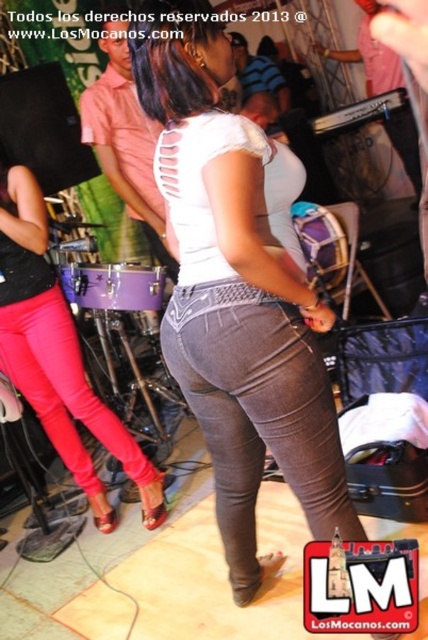
Can you confirm if denim jeans at center is thinner than pink matte pants at left?

Yes, denim jeans at center is thinner than pink matte pants at left.

Who is positioned more to the right, denim jeans at center or pink matte pants at left?

From the viewer's perspective, denim jeans at center appears more on the right side.

This screenshot has height=640, width=428. What are the coordinates of `denim jeans at center` in the screenshot? It's located at (235, 292).

Is denim jeans at center to the left of gray denim jeans at center from the viewer's perspective?

Correct, you'll find denim jeans at center to the left of gray denim jeans at center.

Can you confirm if denim jeans at center is positioned below gray denim jeans at center?

No.

I want to click on denim jeans at center, so click(235, 292).

Where is `denim jeans at center`? This screenshot has height=640, width=428. denim jeans at center is located at coordinates (235, 292).

Does gray denim jeans at center have a lesser height compared to pink matte pants at left?

Correct, gray denim jeans at center is not as tall as pink matte pants at left.

Does gray denim jeans at center have a greater height compared to pink matte pants at left?

In fact, gray denim jeans at center may be shorter than pink matte pants at left.

Measure the distance between gray denim jeans at center and camera.

They are 1.36 meters apart.

What are the coordinates of `gray denim jeans at center` in the screenshot? It's located at (258, 412).